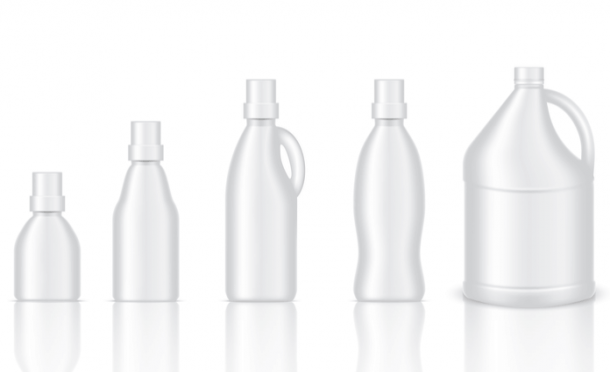
The width and height of the screenshot is (610, 372). What are the coordinates of `bottles` in the screenshot? It's located at (52, 257), (140, 235), (242, 203), (388, 190), (500, 188).